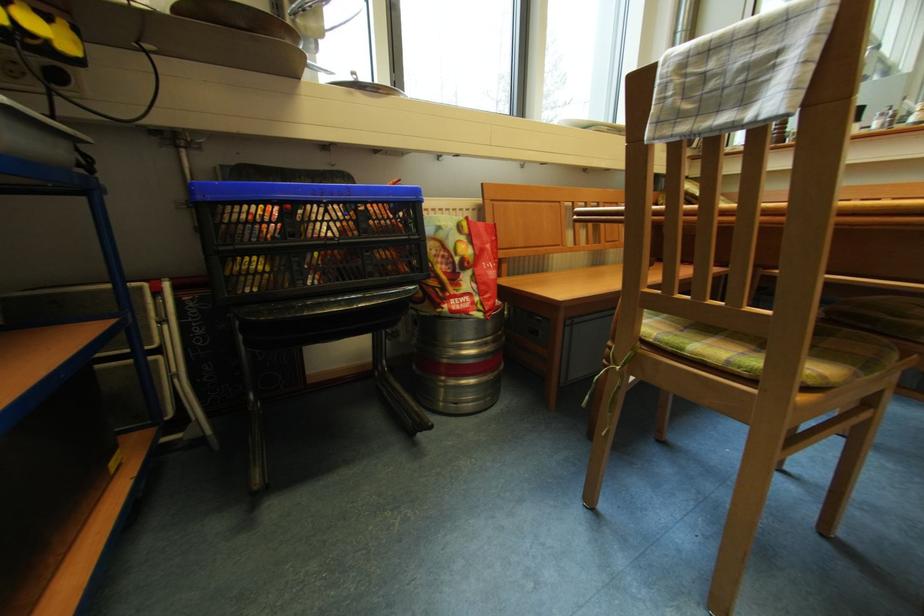
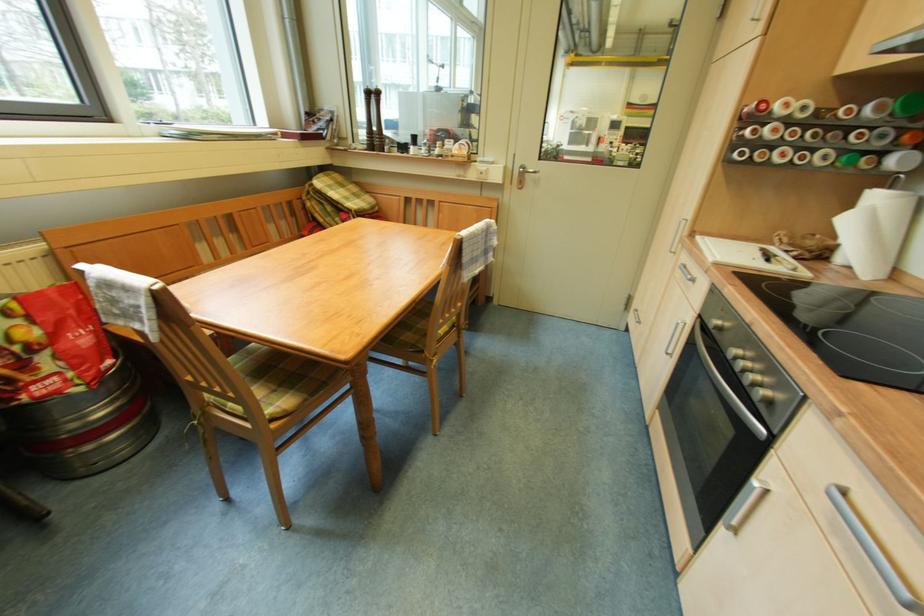
The first image is from the beginning of the video and the second image is from the end. How did the camera likely rotate when shooting the video?

The camera's rotation is toward right-down.